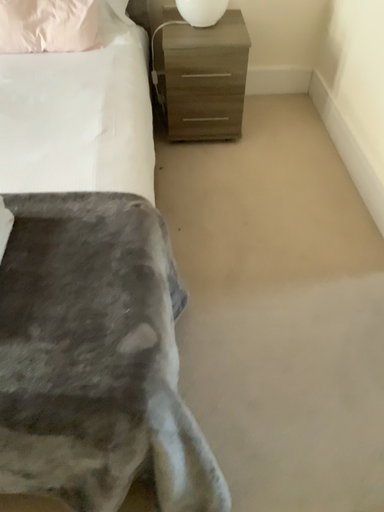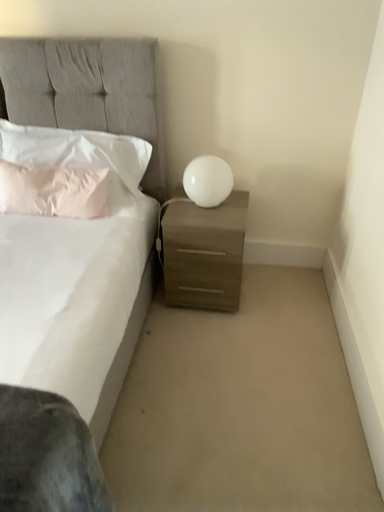
Question: How did the camera likely rotate when shooting the video?

Choices:
 (A) rotated downward
 (B) rotated upward

Answer: (B)